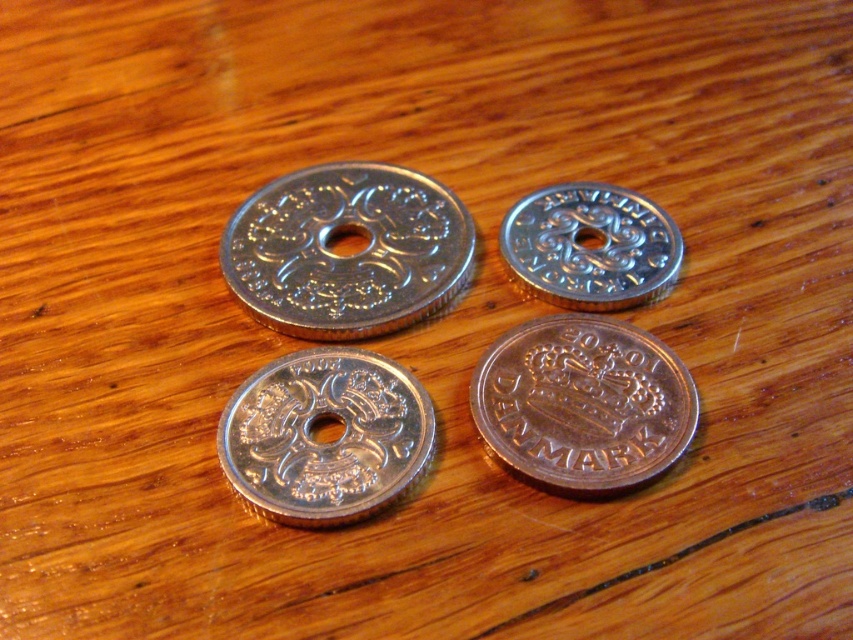
Question: Is silver metallic coin at center closer to the viewer compared to silver/metallic coin at upper right?

Choices:
 (A) no
 (B) yes

Answer: (B)

Question: Which object is closer to the camera taking this photo?

Choices:
 (A) silver/metallic coin at upper right
 (B) shiny silver coin at center

Answer: (B)

Question: Is silver metallic coin at center closer to camera compared to silver/metallic coin at upper right?

Choices:
 (A) no
 (B) yes

Answer: (B)

Question: From the image, what is the correct spatial relationship of shiny silver coin at bottom right in relation to silver/metallic coin at upper right?

Choices:
 (A) left
 (B) right

Answer: (A)

Question: Which of the following is the closest to the observer?

Choices:
 (A) silver metallic coin at center
 (B) shiny silver coin at center
 (C) silver/metallic coin at upper right
 (D) shiny silver coin at bottom right

Answer: (A)

Question: Which is farther from the shiny silver coin at bottom right?

Choices:
 (A) shiny silver coin at center
 (B) silver/metallic coin at upper right
 (C) silver metallic coin at center

Answer: (A)